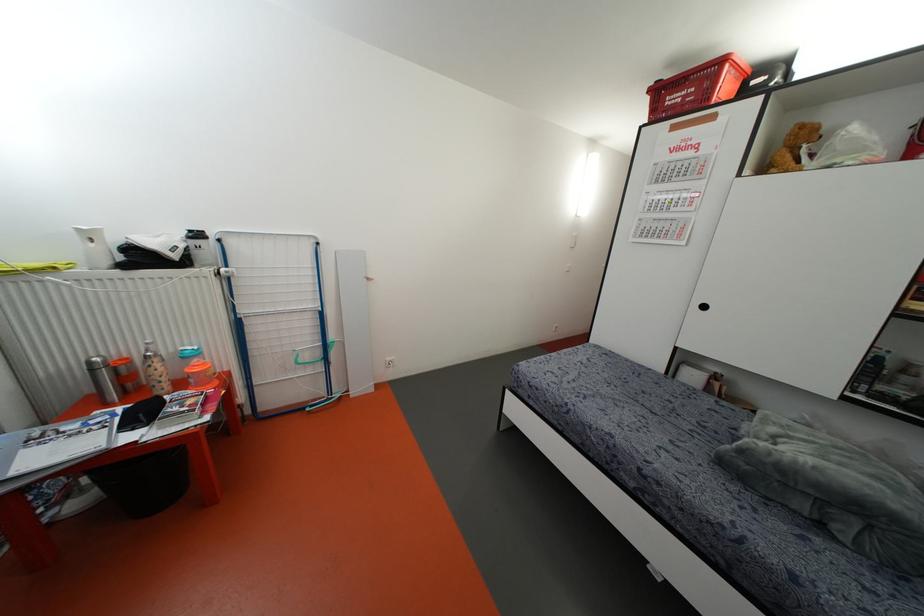
In order to click on red plastic crate in this screenshot , I will do `click(697, 86)`.